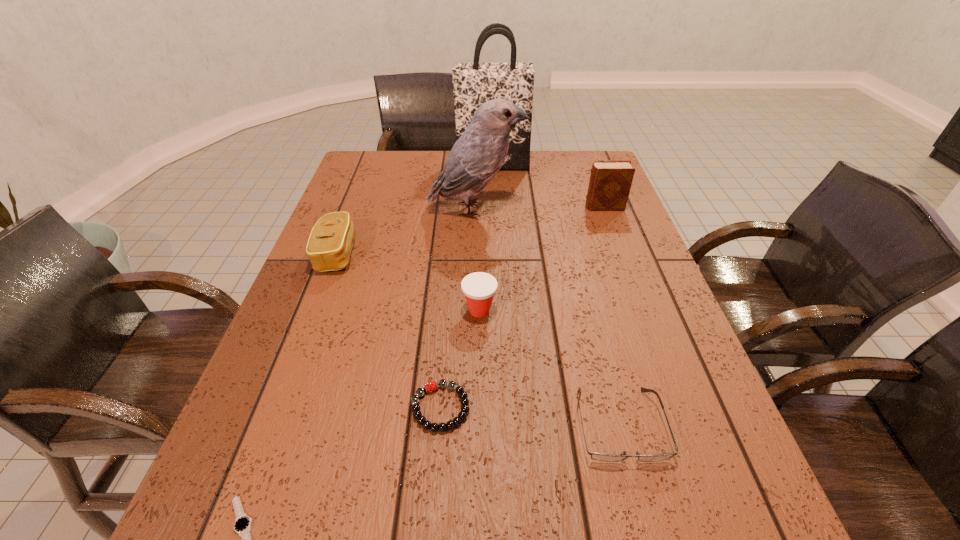
You are a GUI agent. You are given a task and a screenshot of the screen. Output one action in this format:
    pyautogui.click(x=<x>, y=<y>)
    Task: Click on the vacant space located on the spine side of the third tallest object
    The height and width of the screenshot is (540, 960).
    Given the screenshot: What is the action you would take?
    pyautogui.click(x=485, y=207)

Locate an element on the screen. This screenshot has width=960, height=540. vacant point located on the spine side of the third tallest object is located at coordinates (501, 207).

Identify the location of vacant position located 0.240m on the spine side of the third tallest object. Image resolution: width=960 pixels, height=540 pixels. (505, 207).

Identify the location of free space located on the zipper side of the clutch bag. The image size is (960, 540). (451, 254).

At what (x,y) coordinates should I click in order to perform the action: click on free point located on the back of the Dixie cup. Please return your answer as a coordinate pair (x, y). This screenshot has width=960, height=540. Looking at the image, I should click on (479, 205).

Where is `vacant area situated on the front-facing side of the third shortest object`? This screenshot has width=960, height=540. vacant area situated on the front-facing side of the third shortest object is located at coordinates (649, 539).

Identify the location of vacant space located on the right of the second shortest object. The image size is (960, 540). (615, 407).

The height and width of the screenshot is (540, 960). In order to click on object located in the far edge section of the desktop in this screenshot , I will do `click(475, 83)`.

Locate an element on the screen. object located at the left edge is located at coordinates (329, 246).

Image resolution: width=960 pixels, height=540 pixels. Find the location of `diary that is at the right edge`. diary that is at the right edge is located at coordinates (610, 182).